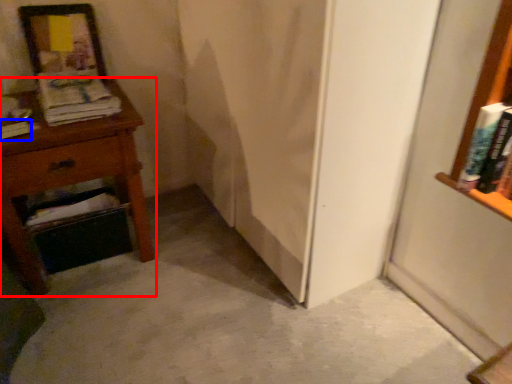
Question: Which of the following is the closest to the observer, nightstand (highlighted by a red box) or book (highlighted by a blue box)?

Choices:
 (A) nightstand
 (B) book

Answer: (A)